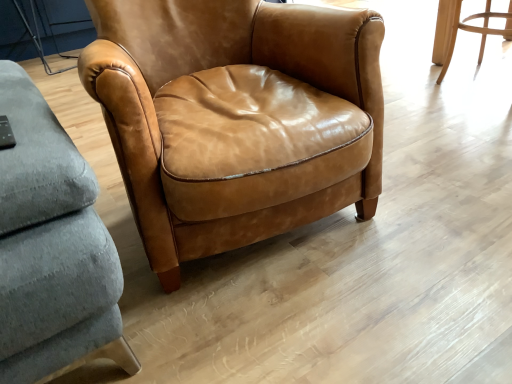
At what (x,y) coordinates should I click in order to perform the action: click on vacant space underneath matte brown leather chair at center, marked as the second chair in a front-to-back arrangement (from a real-world perspective). Please return your answer as a coordinate pair (x, y). This screenshot has height=384, width=512. Looking at the image, I should click on (481, 77).